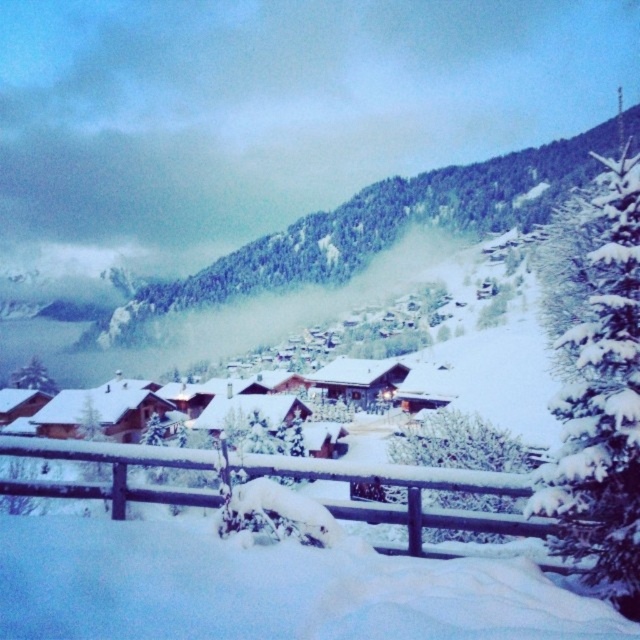
Does snowy forested mountain at center have a lesser height compared to green matte tree at left?

No, snowy forested mountain at center is not shorter than green matte tree at left.

Between snowy forested mountain at center and green matte tree at left, which one appears on the right side from the viewer's perspective?

snowy forested mountain at center

Does point (515, 218) come farther from viewer compared to point (29, 374)?

Yes, point (515, 218) is behind point (29, 374).

Find the location of `snowy forested mountain at center`. snowy forested mountain at center is located at coordinates (374, 227).

Between wooden fence at lower center and green matte tree at left, which one is positioned lower?

green matte tree at left is below.

Is wooden fence at lower center above green matte tree at left?

Correct, wooden fence at lower center is located above green matte tree at left.

What do you see at coordinates (280, 474) in the screenshot? I see `wooden fence at lower center` at bounding box center [280, 474].

This screenshot has height=640, width=640. Identify the location of wooden fence at lower center. (280, 474).

Can you confirm if white snow-covered tree at center is smaller than green matte tree at left?

No, white snow-covered tree at center is not smaller than green matte tree at left.

Is point (468, 508) more distant than point (20, 371)?

No, it is not.

Locate an element on the screen. This screenshot has height=640, width=640. white snow-covered tree at center is located at coordinates (458, 444).